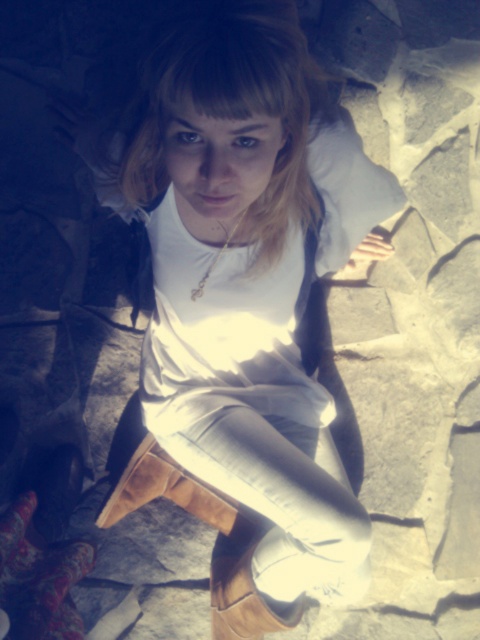
You are a photographer adjusting the lighting for a shoot. You need to ensure that both the white leather boots at center and the gold chain necklace at center are clearly visible in the photo. Given the current lighting setup with a strong light source above, which object might be more affected by the glare and why?

The white leather boots at center might be more affected by the glare because white surfaces typically reflect more light than gold chain necklaces, and since the strong light source is above, the boots could appear overly bright or lose detail due to their light color.

Based on the scene description, where is the white leather boots at center located in terms of coordinates?

The white leather boots at center are located at coordinates point [248,301].

You are a fashion designer trying to create a matching outfit for the person in the image. Given that the white leather boots at center and gold chain necklace at center are 32.15 centimeters apart, can you suggest a way to balance the placement of these two accessories to create a harmonious look?

The white leather boots at center and gold chain necklace at center are 32.15 centimeters apart. To balance their placement, consider positioning the gold chain necklace at center slightly higher or lower to adjust the vertical distance between them, ensuring they complement each other without overwhelming the outfit.